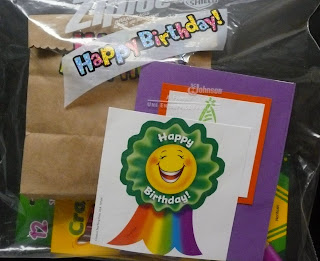
Where is `brown box`? This screenshot has height=261, width=320. brown box is located at coordinates (67, 150).